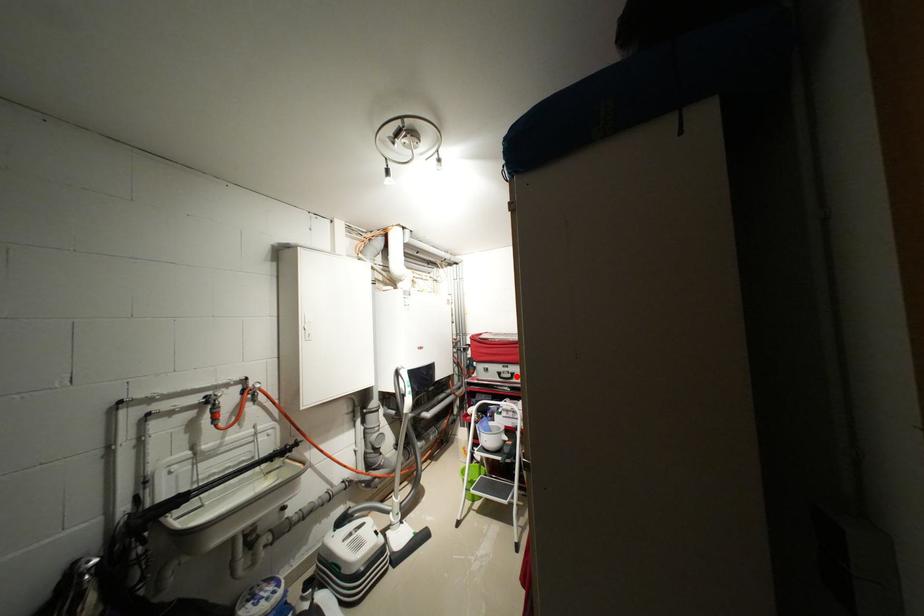
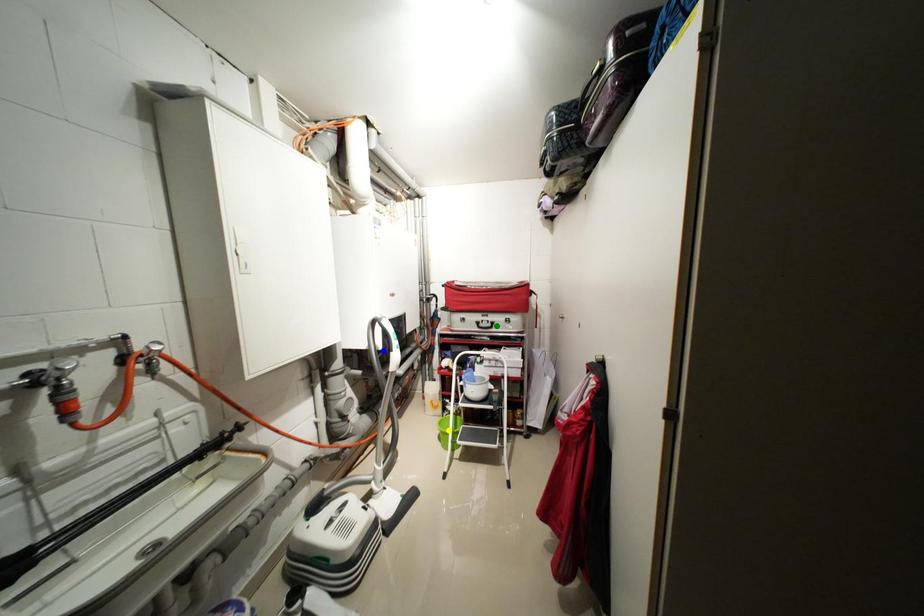
Question: I am providing you with two images of the same scene from different viewpoints. A red point is marked on the first image. You are given multiple points on the second image. In image 2, which mark is for the same physical point as the one in image 1?

Choices:
 (A) yellow point
 (B) blue point
 (C) green point

Answer: (C)